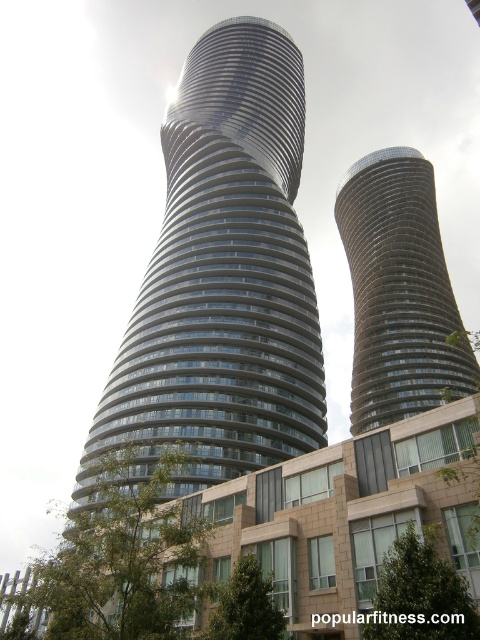
You are standing in front of the two modern skyscrapers. You want to take a photo of both the glassy steel tower at center and the glassy metallic tower at center. Which tower should you focus on first to ensure both are in frame?

You should focus on the glassy steel tower at center first since it is closer to you than the glassy metallic tower at center, allowing you to frame both in the shot by adjusting the camera angle to include the farther tower.

You are an architect analyzing the image of two modern skyscrapers. Which of the two towers, the glassy steel tower at center or the glassy metallic tower at center, has a greater height?

The glassy steel tower at center is much taller than the glassy metallic tower at center, so the glassy steel tower at center has a greater height.

Please provide the exact coordinates of the glassy steel tower at center in the image. The coordinate system uses the bottom left corner as the origin point with x and y axes. The x value increases to the right and the y value increases upward. The coordinates are normalized between 0 and 1. Please answer with the coordinates in the format of a tuple with two decimal places, e.g., 0.12, 0.34.

The glassy steel tower at center is located at coordinates approximately (219, 284).